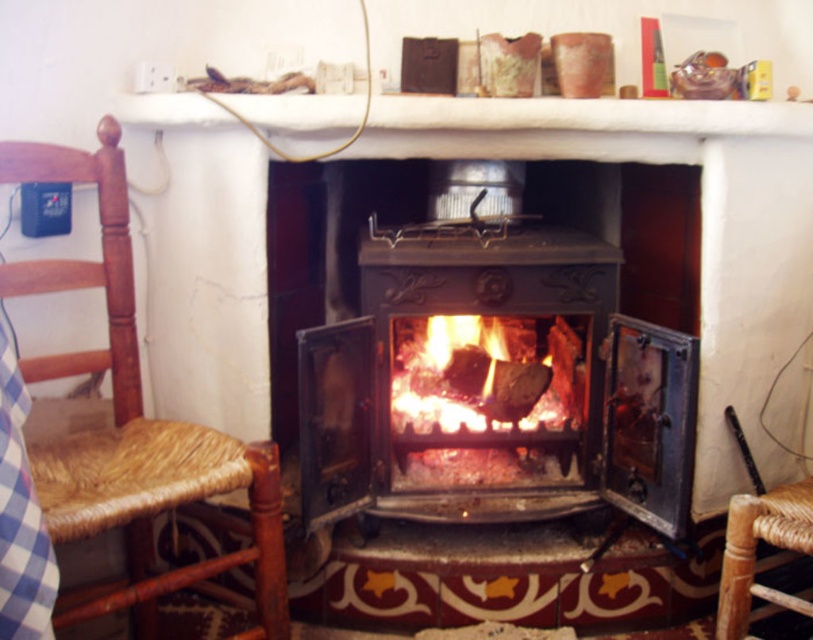
Does shiny black stove at center have a smaller size compared to brown wicker rocking chair at left?

Actually, shiny black stove at center might be larger than brown wicker rocking chair at left.

Does shiny black stove at center have a larger size compared to brown wicker rocking chair at left?

Correct, shiny black stove at center is larger in size than brown wicker rocking chair at left.

What do you see at coordinates (494, 385) in the screenshot? The width and height of the screenshot is (813, 640). I see `shiny black stove at center` at bounding box center [494, 385].

The height and width of the screenshot is (640, 813). In order to click on shiny black stove at center in this screenshot , I will do `click(494, 385)`.

Which is above, shiny black stove at center or charcoal black wood at center?

shiny black stove at center

Between shiny black stove at center and charcoal black wood at center, which one is positioned lower?

Positioned lower is charcoal black wood at center.

Between point (325, 513) and point (572, 454), which one is positioned in front?

Point (325, 513) is in front.

Where is `shiny black stove at center`? shiny black stove at center is located at coordinates (494, 385).

Find the location of a particular element. This screenshot has height=640, width=813. brown wicker rocking chair at left is located at coordinates (133, 422).

Does point (15, 150) come farther from viewer compared to point (407, 406)?

No, (15, 150) is in front of (407, 406).

What do you see at coordinates (133, 422) in the screenshot?
I see `brown wicker rocking chair at left` at bounding box center [133, 422].

You are a GUI agent. You are given a task and a screenshot of the screen. Output one action in this format:
    pyautogui.click(x=<x>, y=<y>)
    Task: Click on the brown wicker rocking chair at left
    The height and width of the screenshot is (640, 813).
    Given the screenshot: What is the action you would take?
    pyautogui.click(x=133, y=422)